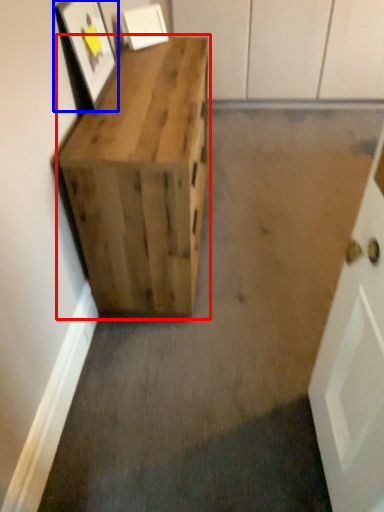
Question: Among these objects, which one is nearest to the camera, furniture (highlighted by a red box) or picture frame (highlighted by a blue box)?

Choices:
 (A) furniture
 (B) picture frame

Answer: (A)